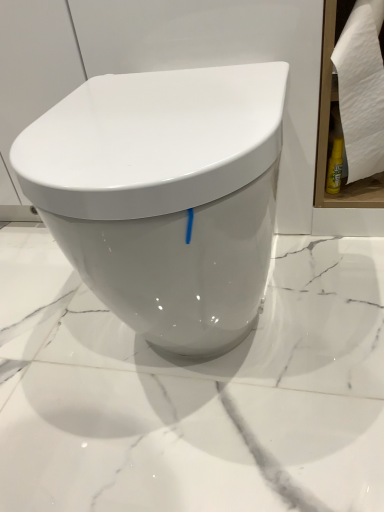
Question: From a real-world perspective, relative to white paper towel at right, is white glossy toilet at center vertically above or below?

Choices:
 (A) below
 (B) above

Answer: (A)

Question: Is white glossy toilet at center taller or shorter than white paper towel at right?

Choices:
 (A) tall
 (B) short

Answer: (A)

Question: From the image's perspective, relative to white paper towel at right, is white glossy toilet at center above or below?

Choices:
 (A) below
 (B) above

Answer: (A)

Question: Relative to white glossy toilet at center, is white paper towel at right in front or behind?

Choices:
 (A) front
 (B) behind

Answer: (B)

Question: Is point (357, 39) closer or farther from the camera than point (178, 89)?

Choices:
 (A) farther
 (B) closer

Answer: (A)

Question: From their relative heights in the image, would you say white paper towel at right is taller or shorter than white glossy toilet at center?

Choices:
 (A) tall
 (B) short

Answer: (B)

Question: Is white paper towel at right inside or outside of white glossy toilet at center?

Choices:
 (A) inside
 (B) outside

Answer: (B)